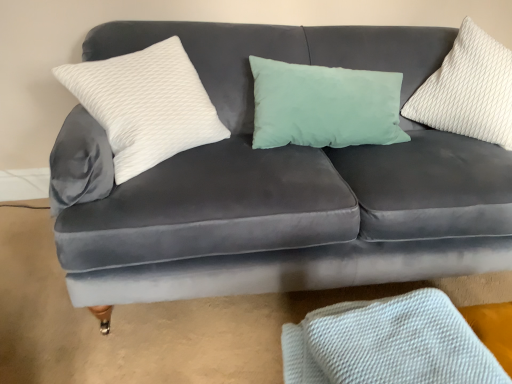
Question: Is white textured pillow at upper right, the first pillow from the right, to the left or to the right of white textured fabric at lower right in the image?

Choices:
 (A) right
 (B) left

Answer: (A)

Question: Is point (476, 38) closer or farther from the camera than point (352, 302)?

Choices:
 (A) closer
 (B) farther

Answer: (B)

Question: Estimate the real-world distances between objects in this image. Which object is closer to the white textured pillow at upper right, the first pillow from the right?

Choices:
 (A) white textured fabric at lower right
 (B) white textured pillow at left, the 1th pillow positioned from the left

Answer: (B)

Question: Considering the real-world distances, which object is farthest from the white textured pillow at left, the 1th pillow positioned from the left?

Choices:
 (A) white textured pillow at upper right, the first pillow from the right
 (B) white textured fabric at lower right

Answer: (A)